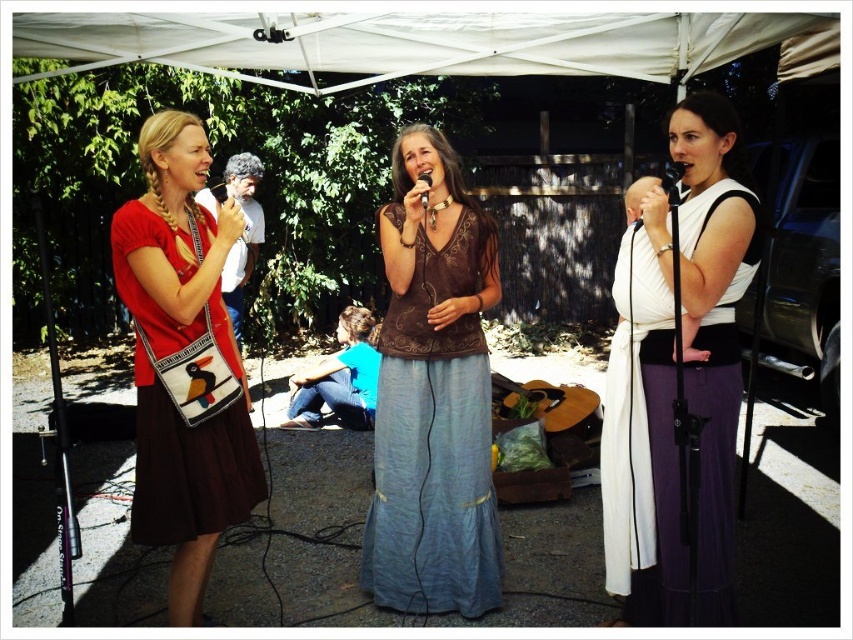
Based on the photo, you are standing at the entrance of the tent and want to find the white silk dress at center. According to the coordinates provided, in which direction should you look to locate it?

The white silk dress at center is located at coordinates point (643,429), so you should look towards the lower right direction from your current position at the entrance.

You are a photographer at the event and want to capture a shot of the central singer holding the black matte microphone at center. To include the wooden acoustic guitar at center in the frame, should you pan your camera to the left or right?

The wooden acoustic guitar at center is to the right of the black matte microphone at center, so you should pan your camera to the right to include the wooden acoustic guitar at center in the frame.